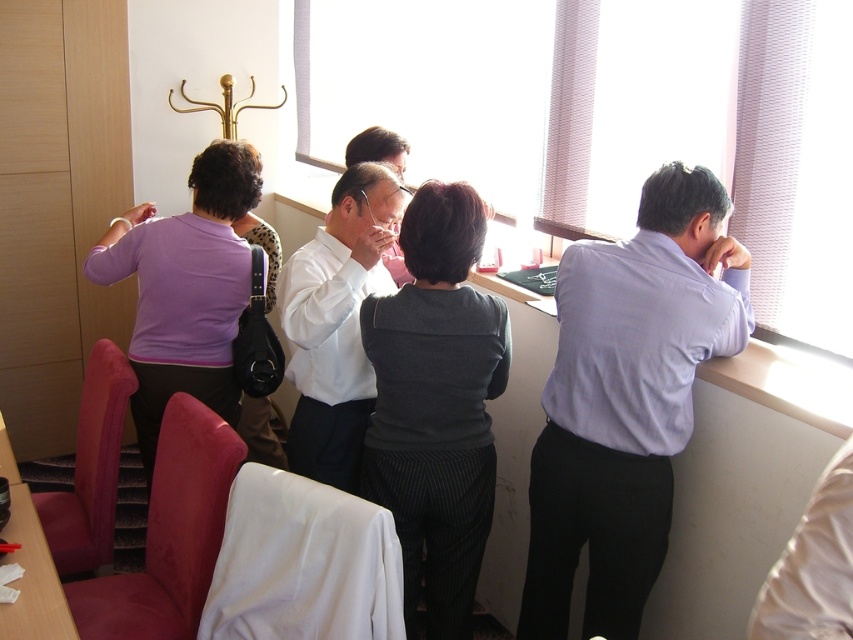
You are a hotel guest who wants to ensure privacy. The transparent glass window at upper center and the dark gray textured sweater at center are both in your room. Which object is taller and can block more light from the window?

The transparent glass window at upper center is much taller than the dark gray textured sweater at center, so it can block more light from the window.

You are a photographer standing in the hotel room. You need to take a group photo of the light blue shirt at right and the purple matte shirt at left. The camera you are using has a maximum focus range of 4 feet. Can you capture both subjects in focus without moving either of them?

The light blue shirt at right is 4.23 feet from the purple matte shirt at left. Since the distance between them exceeds the camera maximum focus range of 4 feet, you cannot capture both subjects in focus without moving them.